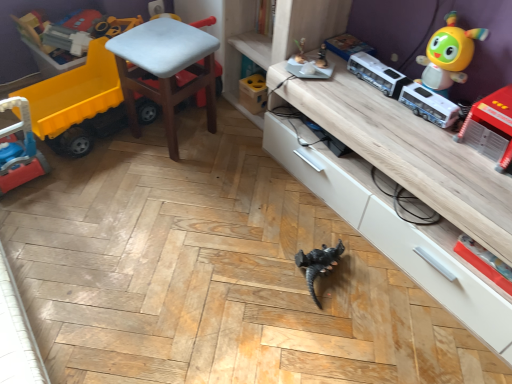
Where is `vacant space to the right of rubber yellow truck at left, which appears as the fifth toy when viewed from the right`? The width and height of the screenshot is (512, 384). vacant space to the right of rubber yellow truck at left, which appears as the fifth toy when viewed from the right is located at coordinates (161, 161).